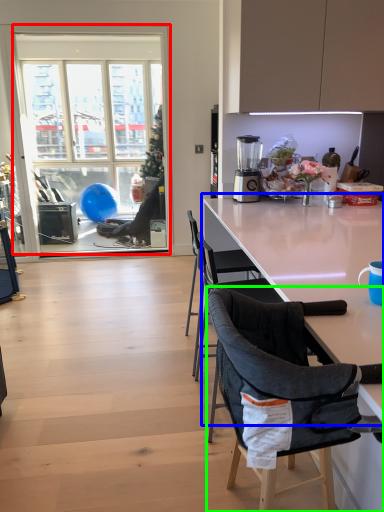
Question: Considering the real-world distances, which object is farthest from window (highlighted by a red box)? kitchen & dining room table (highlighted by a blue box) or chair (highlighted by a green box)?

Choices:
 (A) kitchen & dining room table
 (B) chair

Answer: (B)